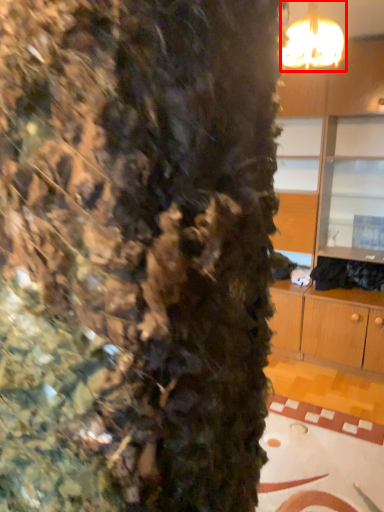
Question: Considering the relative positions of lamp (annotated by the red box) and dresser in the image provided, where is lamp (annotated by the red box) located with respect to the staircase?

Choices:
 (A) right
 (B) left

Answer: (B)